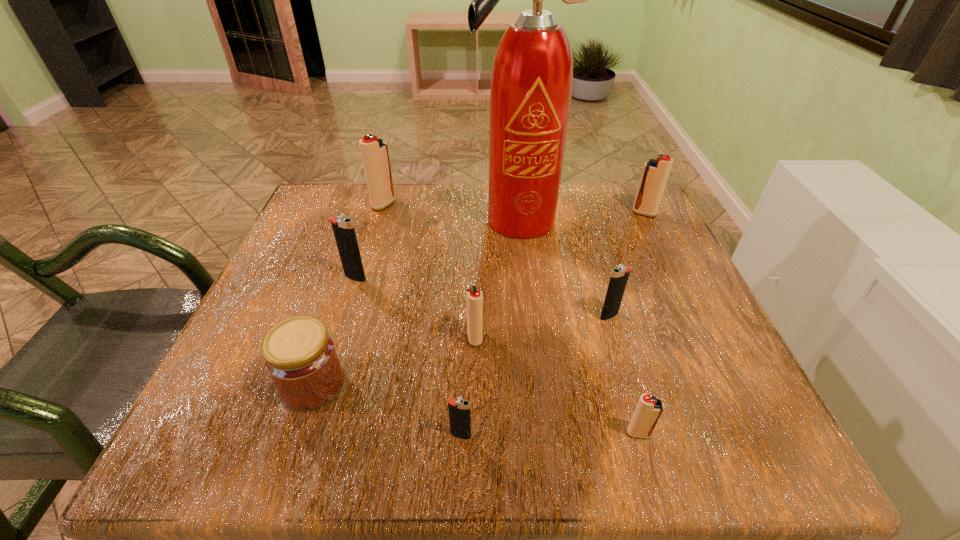
Image resolution: width=960 pixels, height=540 pixels. I want to click on free space located 0.360m on the left of the rightmost igniter, so click(x=482, y=213).

Locate an element on the screen. free space located 0.190m on the right of the sixth nearest object is located at coordinates (463, 278).

The height and width of the screenshot is (540, 960). Find the location of `vacant space situated on the back of the rightmost black igniter`. vacant space situated on the back of the rightmost black igniter is located at coordinates (588, 244).

Identify the location of vacant space positioned on the left of the sixth farthest object. The height and width of the screenshot is (540, 960). (393, 338).

This screenshot has height=540, width=960. Find the location of `vacant space located 0.050m on the left of the red jam`. vacant space located 0.050m on the left of the red jam is located at coordinates (249, 384).

Where is `free space located 0.070m on the right of the third red igniter from left to right`? This screenshot has width=960, height=540. free space located 0.070m on the right of the third red igniter from left to right is located at coordinates (699, 434).

Locate an element on the screen. The width and height of the screenshot is (960, 540). blank space located on the left of the second black igniter from left to right is located at coordinates (416, 435).

In order to click on fire extinguisher located in the far edge section of the desktop in this screenshot , I will do `click(531, 84)`.

The image size is (960, 540). I want to click on jam that is at the near edge, so click(x=300, y=356).

You are a GUI agent. You are given a task and a screenshot of the screen. Output one action in this format:
    pyautogui.click(x=<x>, y=<y>)
    Task: Click on the jam that is at the left edge
    The height and width of the screenshot is (540, 960).
    Given the screenshot: What is the action you would take?
    pyautogui.click(x=300, y=356)